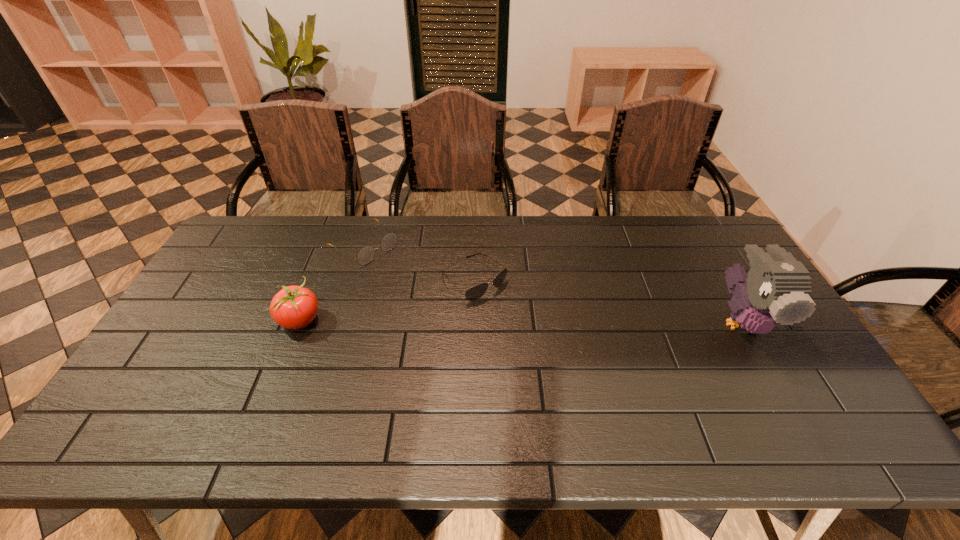
This screenshot has height=540, width=960. Identify the location of vacant space situated 0.120m on the front-facing side of the third object from left to right. (523, 322).

Locate an element on the screen. vacant region located 0.270m on the front-facing side of the third object from left to right is located at coordinates (562, 355).

Identify the location of free space located on the front-facing side of the third object from left to right. This screenshot has height=540, width=960. (567, 360).

Locate an element on the screen. spectacles present at the far edge is located at coordinates (366, 254).

Where is `sunglasses situated at the far edge`? Image resolution: width=960 pixels, height=540 pixels. sunglasses situated at the far edge is located at coordinates (474, 293).

Where is `object located in the right edge section of the desktop`? Image resolution: width=960 pixels, height=540 pixels. object located in the right edge section of the desktop is located at coordinates (777, 290).

Where is `vacant space at the far edge of the desktop`? vacant space at the far edge of the desktop is located at coordinates (340, 242).

In the image, there is a desktop. At what (x,y) coordinates should I click in order to perform the action: click on free space at the near edge. Please return your answer as a coordinate pair (x, y). The width and height of the screenshot is (960, 540). Looking at the image, I should click on (360, 394).

In the image, there is a desktop. Where is `vacant space at the right edge`? This screenshot has height=540, width=960. vacant space at the right edge is located at coordinates (754, 370).

This screenshot has height=540, width=960. I want to click on free region at the far left corner, so click(x=285, y=219).